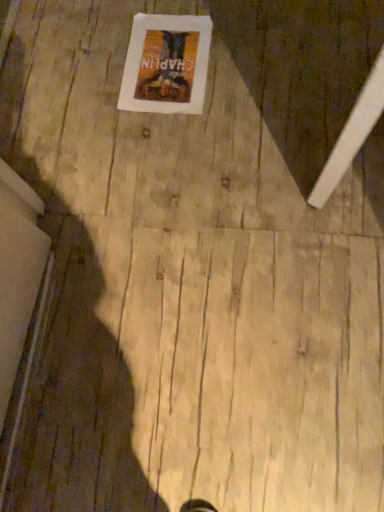
What is the approximate width of matte paper postcard at upper center?

matte paper postcard at upper center is 11.87 inches in width.

What do you see at coordinates (166, 64) in the screenshot?
I see `matte paper postcard at upper center` at bounding box center [166, 64].

Identify the location of matte paper postcard at upper center. (166, 64).

The width and height of the screenshot is (384, 512). Find the location of `matte paper postcard at upper center`. matte paper postcard at upper center is located at coordinates (166, 64).